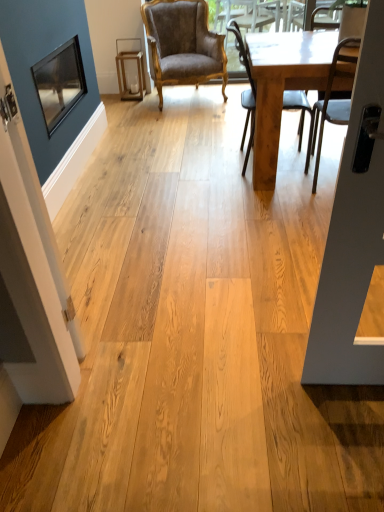
Question: Considering the positions of metallic silver chair at right, the 3th chair from the left, and light brown wooden chair at center, which is the 2th chair in left-to-right order, in the image, is metallic silver chair at right, the 3th chair from the left, wider or thinner than light brown wooden chair at center, which is the 2th chair in left-to-right order,?

Choices:
 (A) wide
 (B) thin

Answer: (B)

Question: From a real-world perspective, is metallic silver chair at right, which is the 3th chair from back to front, physically located above or below light brown wooden chair at center, marked as the 2th chair in a back-to-front arrangement?

Choices:
 (A) above
 (B) below

Answer: (A)

Question: Considering the real-world distances, which object is farthest from the metallic silver chair at right, the 3th chair from the left?

Choices:
 (A) matte black window screen at upper left
 (B) light brown wooden chair at center, arranged as the 2th chair when viewed from the front
 (C) velvet brown armchair at center, which appears as the first chair when viewed from the left
 (D) matte black screen door at left
 (E) light brown wooden table at right

Answer: (D)

Question: Which is nearer to the matte black window screen at upper left?

Choices:
 (A) metallic silver chair at right, arranged as the first chair when viewed from the front
 (B) light brown wooden table at right
 (C) light brown wooden chair at center, which is the 2th chair in left-to-right order
 (D) velvet brown armchair at center, arranged as the third chair when viewed from the front
 (E) matte black screen door at left

Answer: (C)